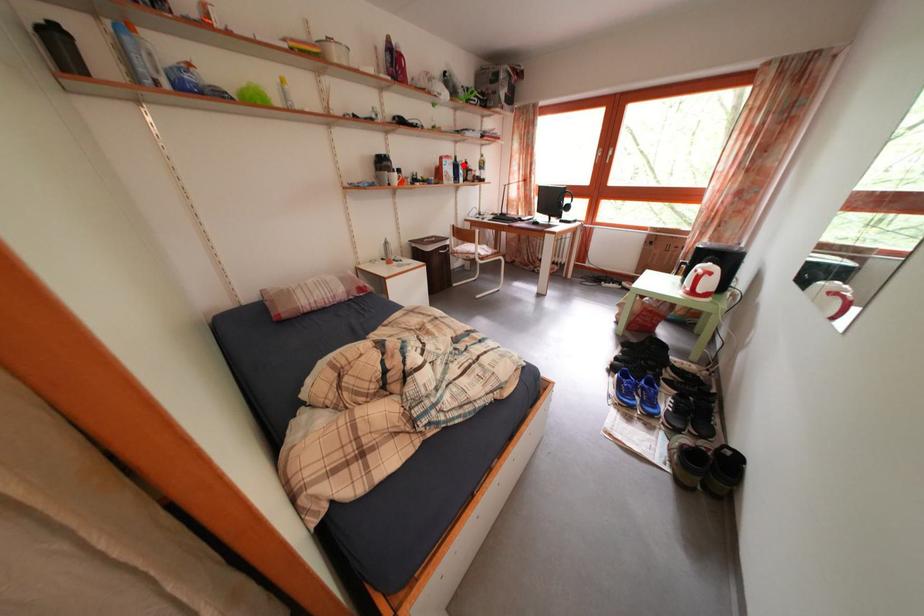
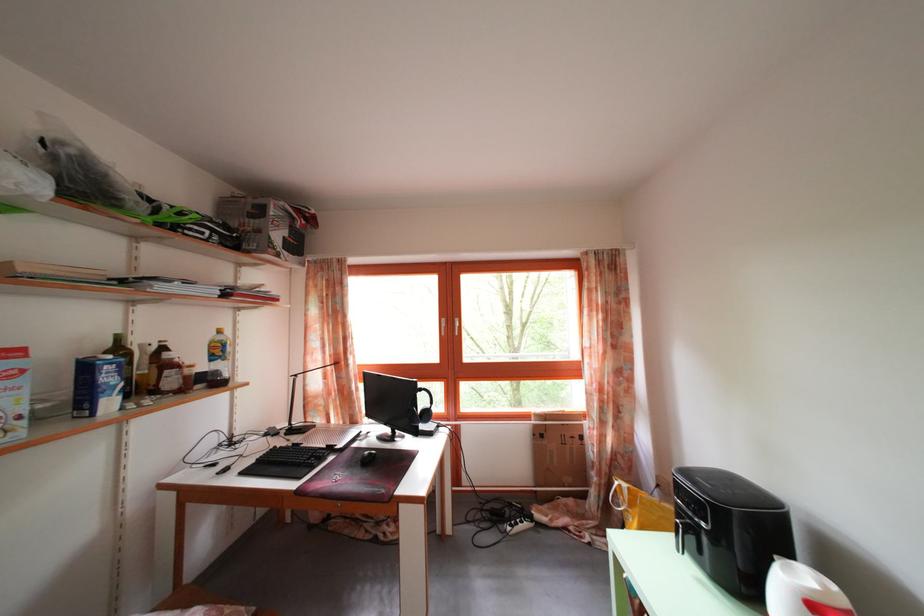
Question: I am providing you with two images of the same scene from different viewpoints. A red point is shown in image1. For the corresponding object point in image2, is it positioned nearer or farther from the camera?

Choices:
 (A) Nearer
 (B) Farther

Answer: (B)